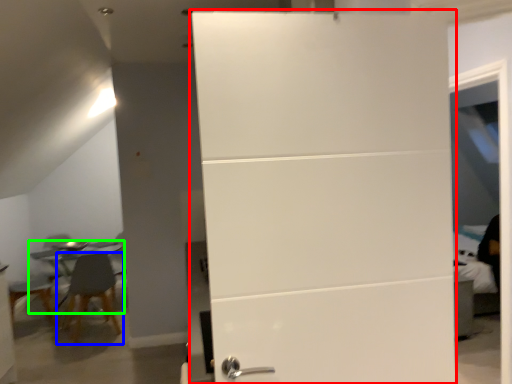
Question: Estimate the real-world distances between objects in this image. Which object is closer to door (highlighted by a red box), chair (highlighted by a blue box) or table (highlighted by a green box)?

Choices:
 (A) chair
 (B) table

Answer: (A)